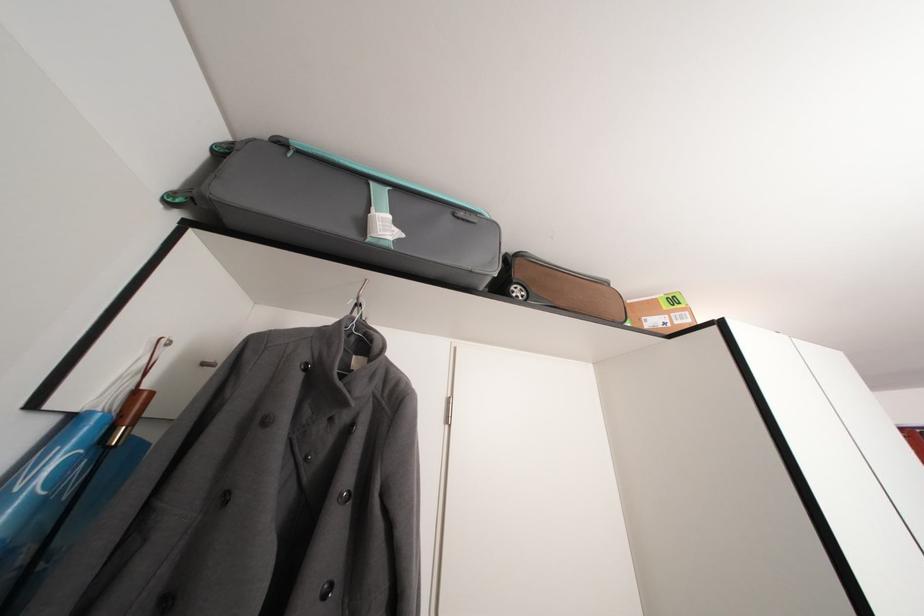
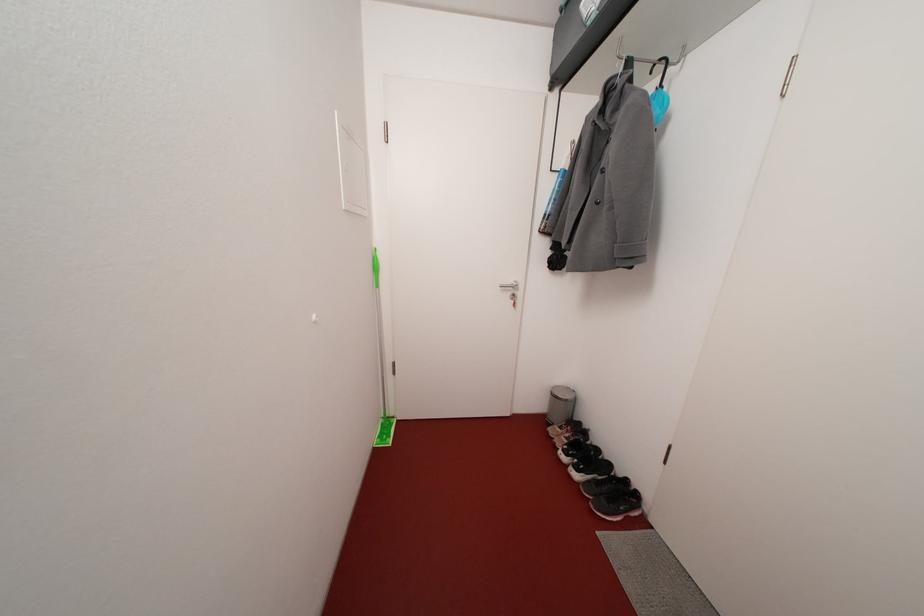
The point at (302, 148) is marked in the first image. Where is the corresponding point in the second image?

(570, 7)